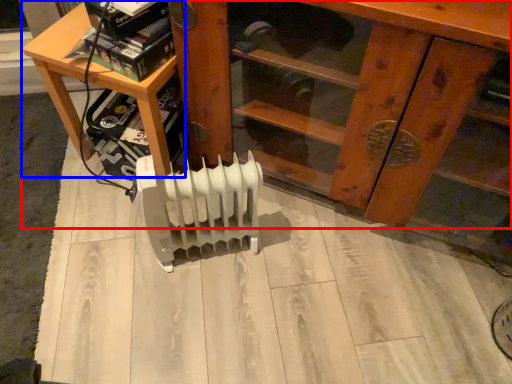
Question: Which object appears farthest to the camera in this image, furniture (highlighted by a red box) or table (highlighted by a blue box)?

Choices:
 (A) furniture
 (B) table

Answer: (B)